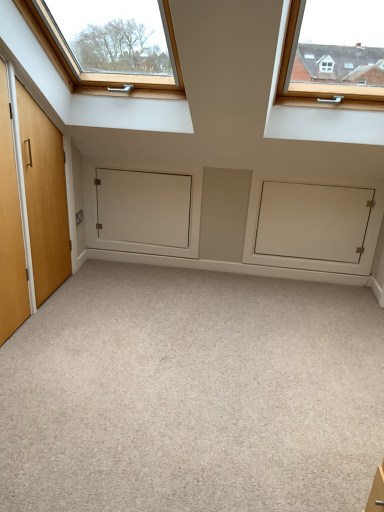
Question: Can you confirm if carpet at center is taller than white matte cabinet at center?

Choices:
 (A) no
 (B) yes

Answer: (A)

Question: From the image's perspective, does carpet at center appear lower than white matte cabinet at center?

Choices:
 (A) no
 (B) yes

Answer: (B)

Question: Is carpet at center positioned before white matte cabinet at center?

Choices:
 (A) no
 (B) yes

Answer: (B)

Question: Is the surface of carpet at center in direct contact with white matte cabinet at center?

Choices:
 (A) yes
 (B) no

Answer: (B)

Question: Considering the relative sizes of carpet at center and white matte cabinet at center in the image provided, is carpet at center shorter than white matte cabinet at center?

Choices:
 (A) no
 (B) yes

Answer: (B)

Question: Is carpet at center turned away from white matte cabinet at center?

Choices:
 (A) no
 (B) yes

Answer: (A)

Question: Is white matte cabinet at center wider than carpet at center?

Choices:
 (A) yes
 (B) no

Answer: (B)

Question: From a real-world perspective, is white matte cabinet at center physically below carpet at center?

Choices:
 (A) no
 (B) yes

Answer: (A)

Question: Considering the relative sizes of white matte cabinet at center and carpet at center in the image provided, is white matte cabinet at center taller than carpet at center?

Choices:
 (A) no
 (B) yes

Answer: (B)

Question: Would you say white matte cabinet at center contains carpet at center?

Choices:
 (A) yes
 (B) no

Answer: (B)

Question: Is white matte cabinet at center closer to the viewer compared to carpet at center?

Choices:
 (A) no
 (B) yes

Answer: (A)

Question: Is white matte cabinet at center turned away from carpet at center?

Choices:
 (A) no
 (B) yes

Answer: (A)

Question: Are carpet at center and white matte door at center far apart?

Choices:
 (A) yes
 (B) no

Answer: (A)